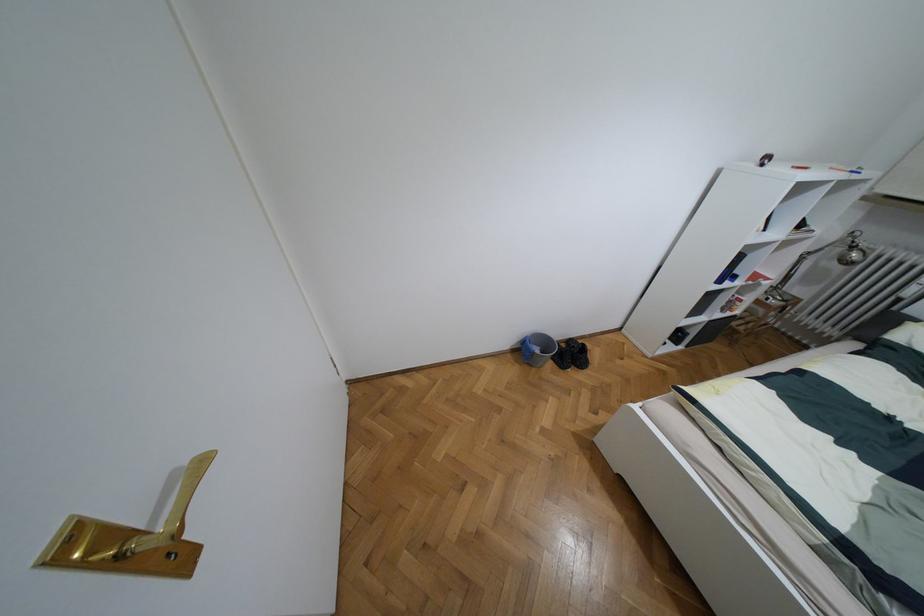
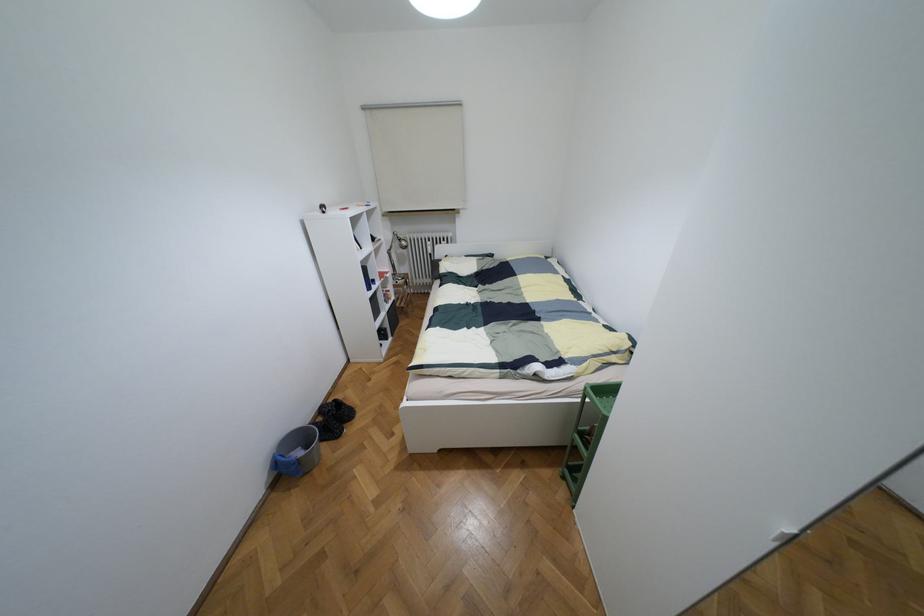
Question: The camera is either moving clockwise (left) or counter-clockwise (right) around the object. The first image is from the beginning of the video and the second image is from the end. Is the camera moving left or right when shooting the video?

Choices:
 (A) Left
 (B) Right

Answer: (A)